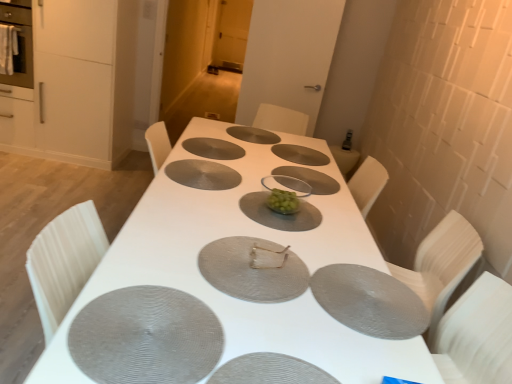
This screenshot has height=384, width=512. Identify the location of vacant area that is situated to the right of gray textured placemat at center, the fourth pizza pan viewed from the back. (255, 179).